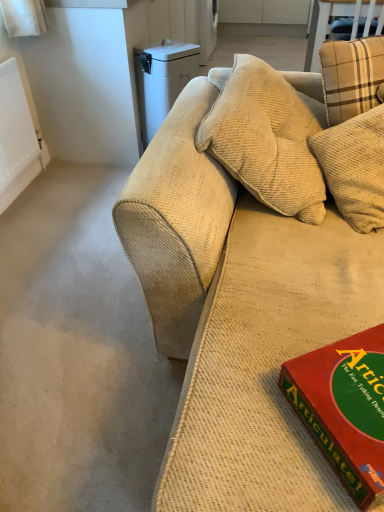
What do you see at coordinates (162, 81) in the screenshot? I see `white plastic trash can at upper left` at bounding box center [162, 81].

Measure the distance between red matte board game at lower right and camera.

red matte board game at lower right and camera are 66.58 centimeters apart.

This screenshot has height=512, width=384. What do you see at coordinates (239, 319) in the screenshot?
I see `beige corduroy couch at center` at bounding box center [239, 319].

Locate an element on the screen. Image resolution: width=384 pixels, height=512 pixels. white plastic trash can at upper left is located at coordinates (162, 81).

From a real-world perspective, is beige corduroy couch at center above or below white plastic trash can at upper left?

beige corduroy couch at center is situated lower than white plastic trash can at upper left in the real world.

Between point (174, 250) and point (146, 65), which one is positioned behind?

The point (146, 65) is more distant.

Can you confirm if beige corduroy couch at center is positioned to the right of white plastic trash can at upper left?

Indeed, beige corduroy couch at center is positioned on the right side of white plastic trash can at upper left.

Would you consider beige corduroy couch at center to be distant from white plastic trash can at upper left?

Absolutely, beige corduroy couch at center is distant from white plastic trash can at upper left.

This screenshot has width=384, height=512. In order to click on studio couch above the white plastic trash can at upper left (from the image's perspective) in this screenshot , I will do pyautogui.click(x=239, y=319).

From a real-world perspective, which is physically above, white plastic trash can at upper left or beige corduroy couch at center?

white plastic trash can at upper left.

Looking at this image, is white plastic trash can at upper left aimed at beige corduroy couch at center?

No, white plastic trash can at upper left is not oriented towards beige corduroy couch at center.

Can you confirm if white plastic trash can at upper left is bigger than beige corduroy couch at center?

Actually, white plastic trash can at upper left might be smaller than beige corduroy couch at center.

From a real-world perspective, is red matte board game at lower right above or below beige corduroy couch at center?

In terms of real-world spatial position, red matte board game at lower right is above beige corduroy couch at center.

Which object is further away from the camera taking this photo, red matte board game at lower right or beige corduroy couch at center?

beige corduroy couch at center is behind.

Is red matte board game at lower right taller than beige corduroy couch at center?

Indeed, red matte board game at lower right has a greater height compared to beige corduroy couch at center.

Would you say red matte board game at lower right contains beige corduroy couch at center?

No, red matte board game at lower right does not contain beige corduroy couch at center.

In terms of size, does beige corduroy couch at center appear bigger or smaller than red matte board game at lower right?

beige corduroy couch at center is bigger than red matte board game at lower right.

Find the location of a particular element. paperback book above the beige corduroy couch at center (from a real-world perspective) is located at coordinates (344, 407).

Does beige corduroy couch at center contain red matte board game at lower right?

No, red matte board game at lower right is not surrounded by beige corduroy couch at center.

Is beige corduroy couch at center closer to camera compared to red matte board game at lower right?

No.

Is white plastic trash can at upper left further to the viewer compared to red matte board game at lower right?

Yes, the depth of white plastic trash can at upper left is greater than that of red matte board game at lower right.

Is white plastic trash can at upper left far from red matte board game at lower right?

Yes, white plastic trash can at upper left and red matte board game at lower right are quite far apart.

From a real-world perspective, who is located lower, white plastic trash can at upper left or red matte board game at lower right?

From a 3D spatial view, white plastic trash can at upper left is below.

Would you say red matte board game at lower right is part of white plastic trash can at upper left's contents?

Actually, red matte board game at lower right is outside white plastic trash can at upper left.

Is point (292, 377) positioned before point (153, 79)?

Yes, point (292, 377) is closer to viewer.

In the scene shown: Does red matte board game at lower right appear on the left side of white plastic trash can at upper left?

No, red matte board game at lower right is not to the left of white plastic trash can at upper left.

From a real-world perspective, is red matte board game at lower right physically located above or below white plastic trash can at upper left?

Clearly, from a real-world perspective, red matte board game at lower right is above white plastic trash can at upper left.

Locate an element on the screen. The image size is (384, 512). appliance located above the beige corduroy couch at center (from a real-world perspective) is located at coordinates (162, 81).

Image resolution: width=384 pixels, height=512 pixels. I want to click on studio couch that appears below the white plastic trash can at upper left (from a real-world perspective), so click(x=239, y=319).

Considering their positions, is red matte board game at lower right positioned further to white plastic trash can at upper left than beige corduroy couch at center?

Result: The object further to white plastic trash can at upper left is red matte board game at lower right.

Considering their positions, is beige corduroy couch at center positioned closer to red matte board game at lower right than white plastic trash can at upper left?

beige corduroy couch at center lies closer to red matte board game at lower right than the other object.

Estimate the real-world distances between objects in this image. Which object is closer to white plastic trash can at upper left, beige corduroy couch at center or red matte board game at lower right?

beige corduroy couch at center is positioned closer to the anchor white plastic trash can at upper left.

Looking at the image, which one is located further to beige corduroy couch at center, red matte board game at lower right or white plastic trash can at upper left?

white plastic trash can at upper left is positioned further to the anchor beige corduroy couch at center.

From the image, which object appears to be nearer to beige corduroy couch at center, white plastic trash can at upper left or red matte board game at lower right?

red matte board game at lower right is positioned closer to the anchor beige corduroy couch at center.

Estimate the real-world distances between objects in this image. Which object is closer to red matte board game at lower right, white plastic trash can at upper left or beige corduroy couch at center?

beige corduroy couch at center.

In order to click on studio couch between red matte board game at lower right and white plastic trash can at upper left along the z-axis in this screenshot , I will do `click(239, 319)`.